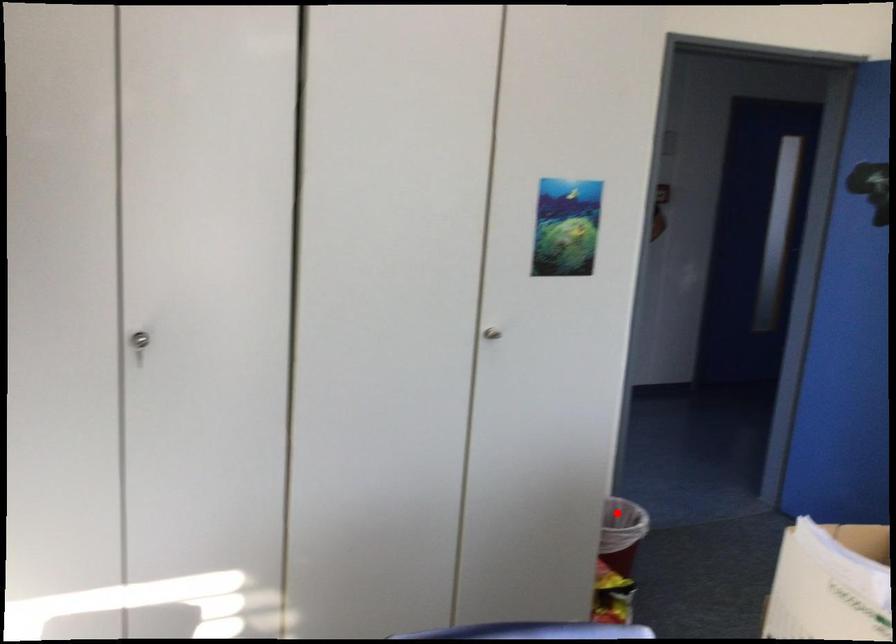
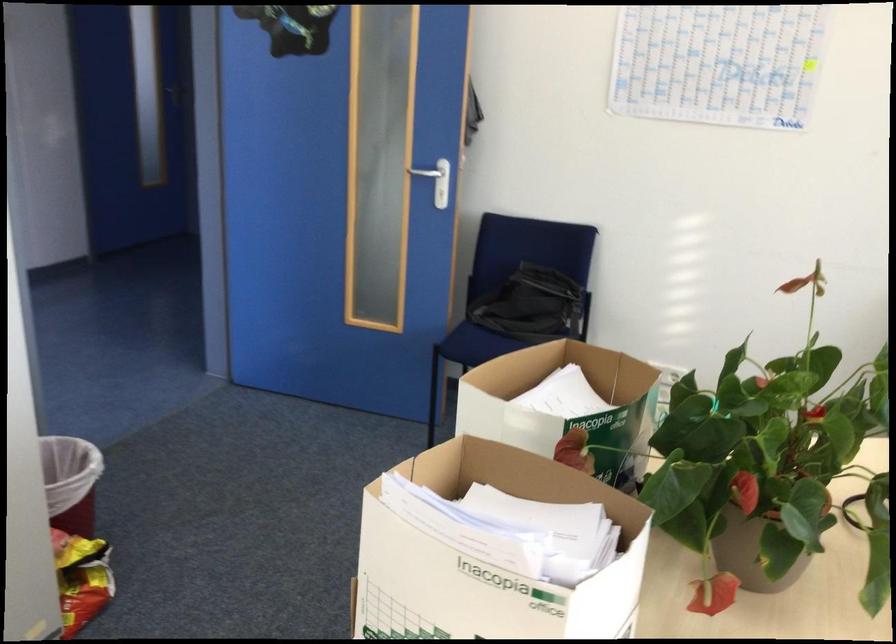
Question: I am providing you with two images of the same scene from different viewpoints. In image1, a red point is highlighted. Considering the same 3D point in image2, which of the following is correct?

Choices:
 (A) It is closer
 (B) It is farther

Answer: (A)